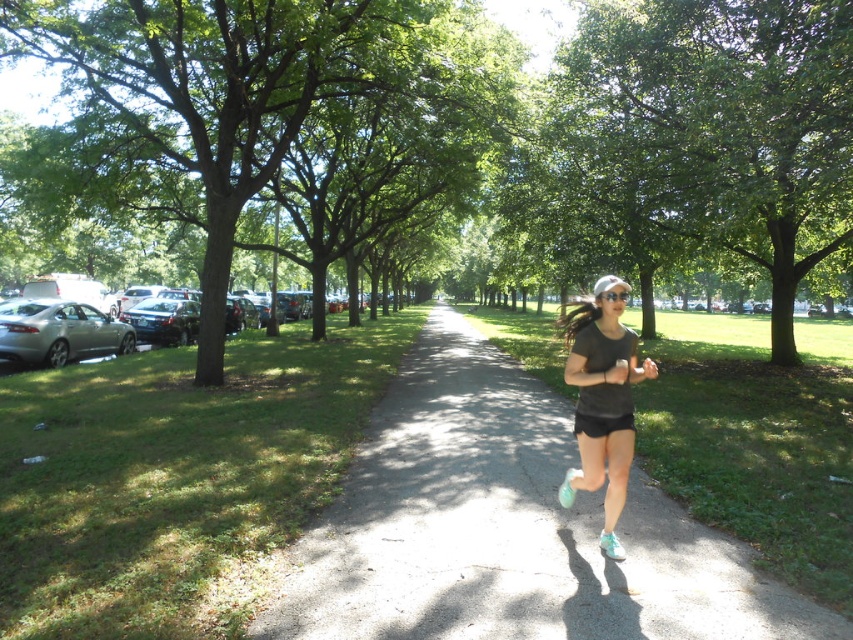
Question: Which point is farther to the camera?

Choices:
 (A) white matte running shoe at center
 (B) matte gray asphalt path at center

Answer: (A)

Question: Which of the following is the closest to the observer?

Choices:
 (A) teal fabric running shoe at lower center
 (B) dark gray matte t-shirt at center

Answer: (B)

Question: In this image, where is matte gray asphalt path at center located relative to white matte running shoe at center?

Choices:
 (A) above
 (B) below

Answer: (A)

Question: Which object is the closest to the matte gray asphalt path at center?

Choices:
 (A) teal fabric running shoe at lower center
 (B) dark gray matte t-shirt at center
 (C) white matte running shoe at center

Answer: (A)

Question: Is matte gray asphalt path at center closer to camera compared to dark gray matte t-shirt at center?

Choices:
 (A) no
 (B) yes

Answer: (B)

Question: Can you confirm if dark gray matte t-shirt at center is positioned above white matte running shoe at center?

Choices:
 (A) no
 (B) yes

Answer: (B)